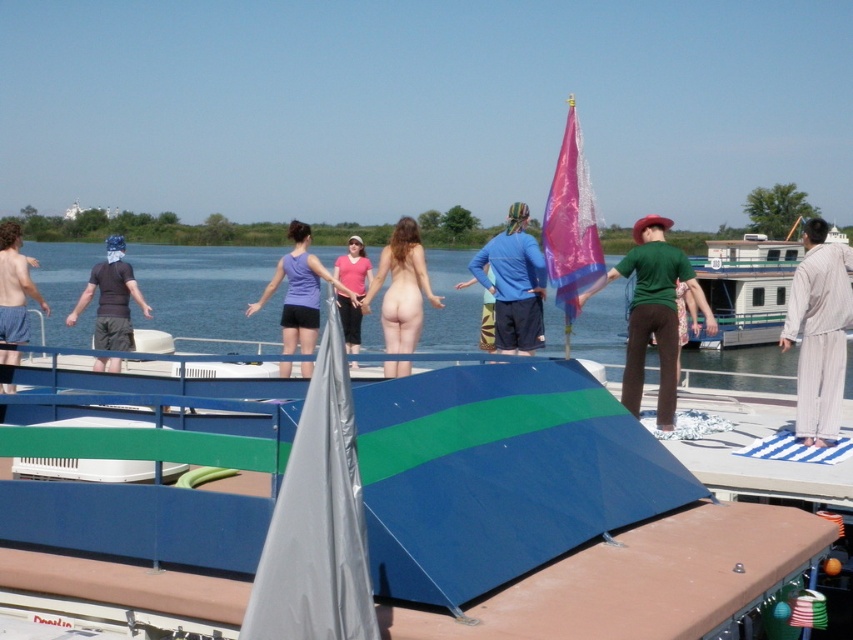
Is green matte shirt at center below blue cotton shirt at center?

Indeed, green matte shirt at center is positioned under blue cotton shirt at center.

Looking at this image, does green matte shirt at center come behind blue cotton shirt at center?

No, it is not.

Where is `green matte shirt at center`? The image size is (853, 640). green matte shirt at center is located at coordinates (653, 312).

This screenshot has width=853, height=640. What are the coordinates of `green matte shirt at center` in the screenshot? It's located at (653, 312).

Is point (811, 280) closer to viewer compared to point (405, 339)?

That is True.

From the picture: Who is positioned more to the left, light beige robe at right or nude skin at center?

From the viewer's perspective, nude skin at center appears more on the left side.

This screenshot has width=853, height=640. I want to click on light beige robe at right, so click(x=819, y=332).

You are a GUI agent. You are given a task and a screenshot of the screen. Output one action in this format:
    pyautogui.click(x=<x>, y=<y>)
    Task: Click on the light beige robe at right
    
    Given the screenshot: What is the action you would take?
    pyautogui.click(x=819, y=332)

Who is positioned more to the right, transparent water at center or purple fabric tank top at center?

transparent water at center

Who is taller, transparent water at center or purple fabric tank top at center?

transparent water at center

Locate an element on the screen. The width and height of the screenshot is (853, 640). transparent water at center is located at coordinates (206, 289).